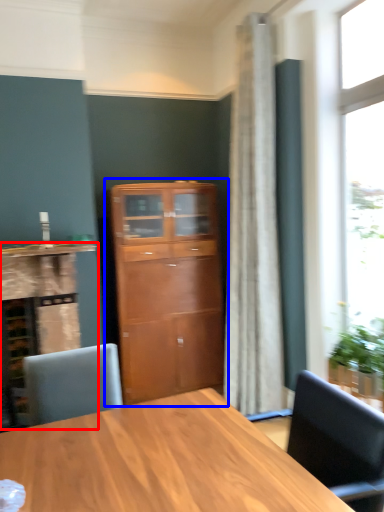
Question: Among these objects, which one is farthest to the camera, cabinetry (highlighted by a red box) or cupboard (highlighted by a blue box)?

Choices:
 (A) cabinetry
 (B) cupboard

Answer: (B)